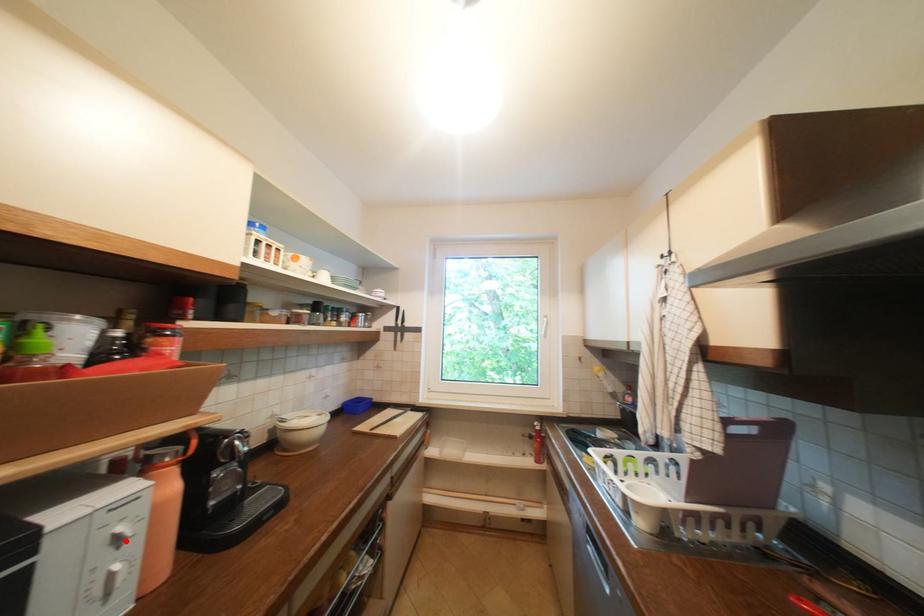
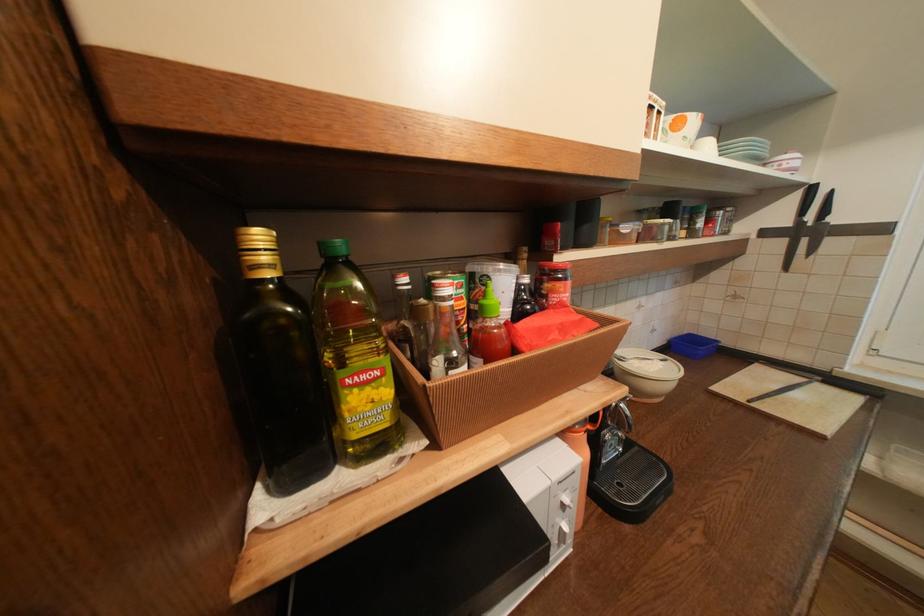
Question: I am providing you with two images of the same scene from different viewpoints. A red point is marked on the first image. Is the red point's position out of view in image 2?

Choices:
 (A) Yes
 (B) No

Answer: (B)